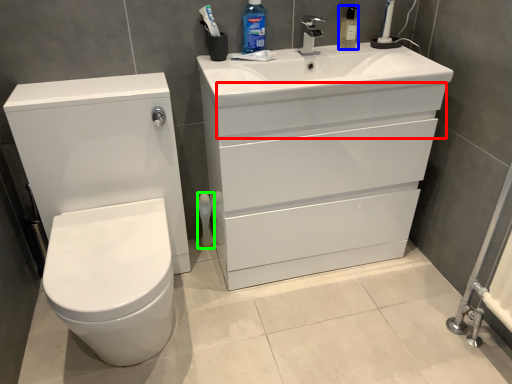
Question: Which is farther away from drawer (highlighted by a red box)? cleaning product (highlighted by a blue box) or toiletry (highlighted by a green box)?

Choices:
 (A) cleaning product
 (B) toiletry

Answer: (B)